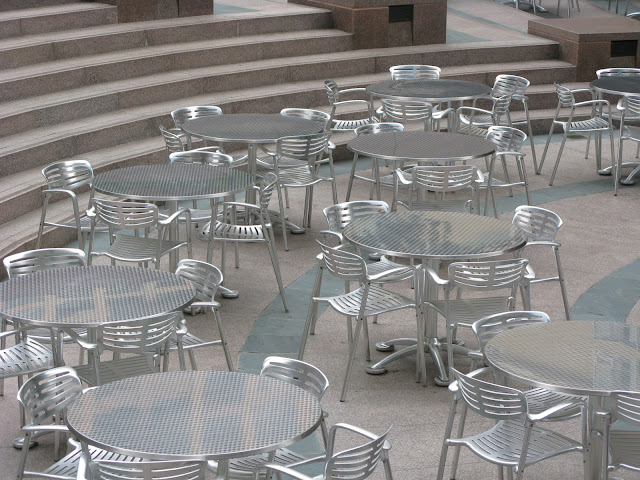
Find the location of a particular element. stairs is located at coordinates (24, 229), (25, 188), (28, 143), (33, 112), (40, 63), (45, 37), (40, 12).